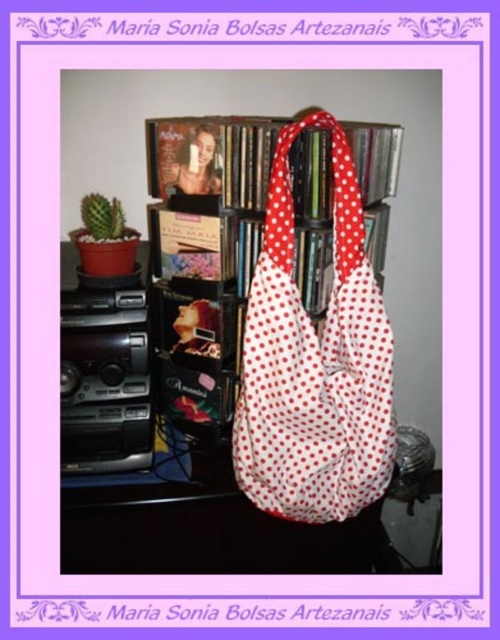
You are standing in front of a handmade bag with a white base and red polka dots. The bag has two long straps and is placed on a black shelving unit. There is a small potted cactus on the left side of the shelf. If you were to place a small ornament at the coordinates point (274, 428), where would it land?

The point (274, 428) is on the white fabric bag at center, so placing the ornament there would place it on the bag.

You are trying to decide between two bags displayed in the image. The first is the white fabric bag at center and the second is the white polka dot fabric shoulder bag at center. Which one would you choose if you want a bigger bag?

The white fabric bag at center is larger in size than the white polka dot fabric shoulder bag at center, so you should choose the white fabric bag at center for a bigger option.